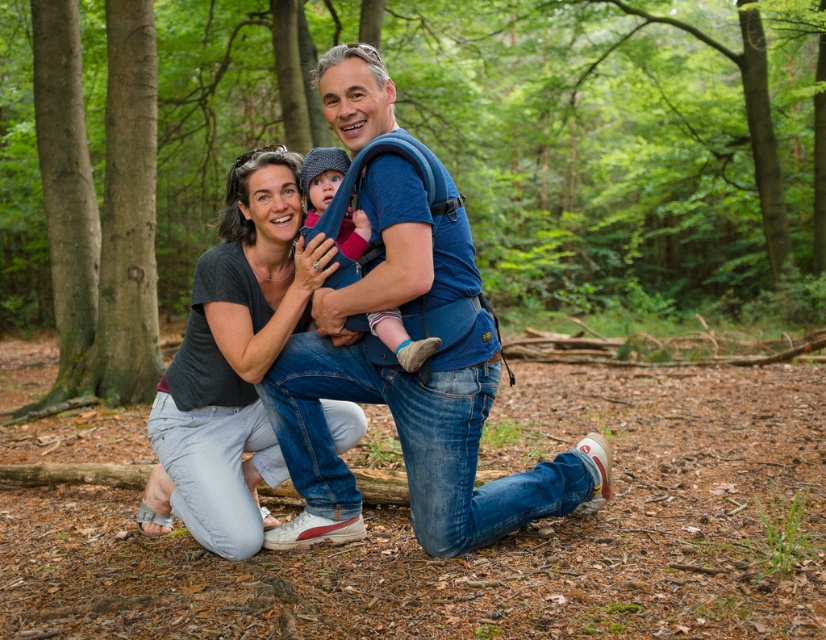
You are a photographer standing in the forest and want to take a photo of the matte gray shirt at center and the knitted wool hat at center. Which object should you focus on first to ensure both are in sharp focus?

You should focus on the matte gray shirt at center first because it is closer to you than the knitted wool hat at center, ensuring both will be in focus when focused on the closer object.

In the family moment captured in the forest, there is a green leafy forest at center and a knitted wool hat at center. Which object is taller?

The green leafy forest at center is much taller than the knitted wool hat at center.

You are a photographer trying to capture a photo of the green leafy forest at center and the blue fabric baby carrier at center. Based on their heights, which object should you focus on first if you want to ensure both are in the frame without adjusting your camera angle?

The green leafy forest at center is taller than the blue fabric baby carrier at center, so you should focus on the green leafy forest at center first to ensure it fits within the frame.